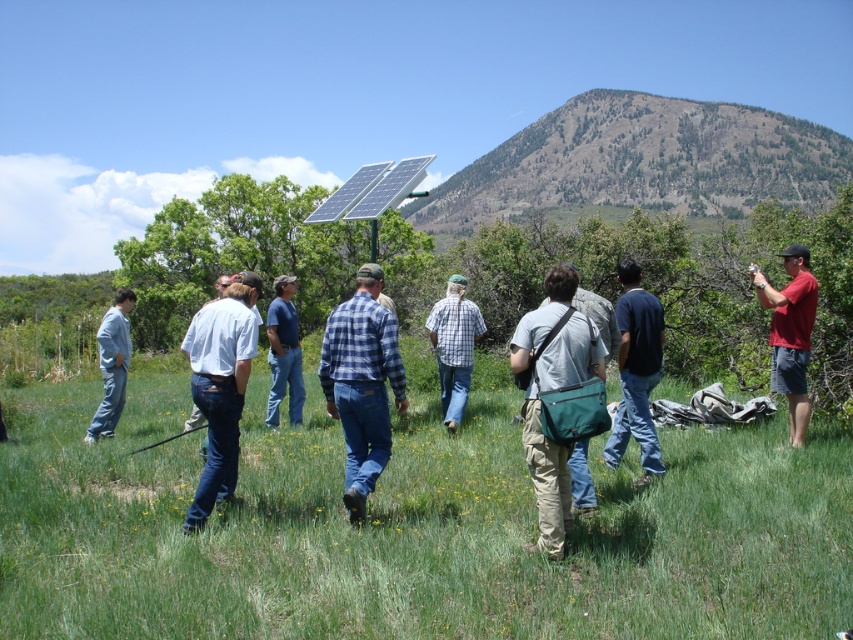
Question: Which object is the farthest from the green textured hillside at upper center?

Choices:
 (A) teal fabric bag at center
 (B) dark blue shirt at center

Answer: (A)

Question: Which object is the farthest from the light blue jeans at left?

Choices:
 (A) white cotton shirt at center
 (B) dark blue shirt at center
 (C) plaid shirt at center
 (D) red cotton shirt at right

Answer: (D)

Question: Is green textured hillside at upper center wider than dark blue shirt at center?

Choices:
 (A) yes
 (B) no

Answer: (A)

Question: Is red cotton shirt at right bigger than light blue jeans at left?

Choices:
 (A) no
 (B) yes

Answer: (A)

Question: Estimate the real-world distances between objects in this image. Which object is closer to the teal fabric bag at center?

Choices:
 (A) white cotton shirt at center
 (B) plaid shirt at center
 (C) dark blue shirt at center

Answer: (C)

Question: Can you confirm if white cotton shirt at center is wider than light blue jeans at left?

Choices:
 (A) yes
 (B) no

Answer: (B)